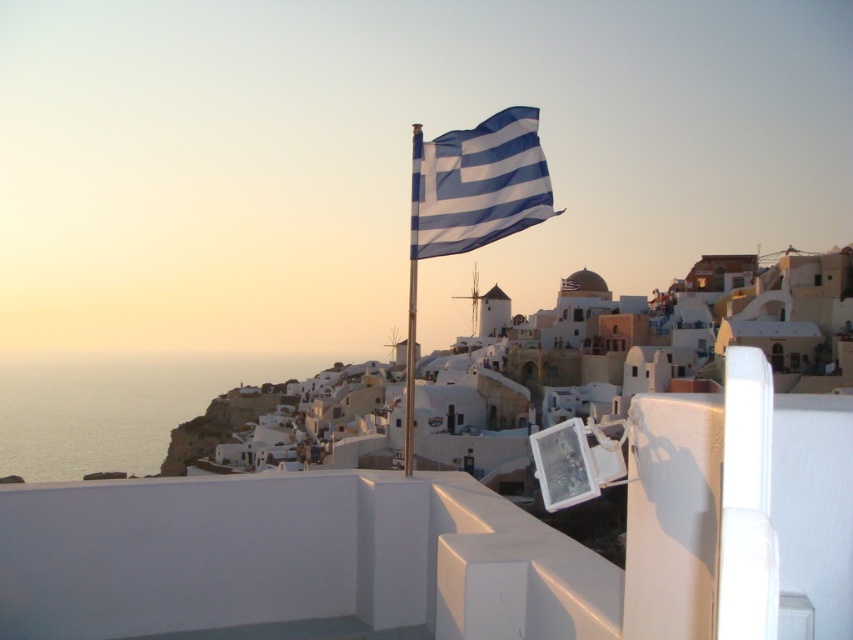
Question: Which of the following is the closest to the observer?

Choices:
 (A) (532, 154)
 (B) (436, 372)

Answer: (A)

Question: Which point is farther to the camera?

Choices:
 (A) coord(705,380)
 (B) coord(527,115)

Answer: (A)

Question: Does blue and white striped flag at center have a greater width compared to metallic silver flag pole at center?

Choices:
 (A) no
 (B) yes

Answer: (B)

Question: Does blue and white striped flag at center appear under metallic silver flag pole at center?

Choices:
 (A) yes
 (B) no

Answer: (B)

Question: Which point is closer to the camera?

Choices:
 (A) (543, 381)
 (B) (485, 173)
 (C) (415, 330)

Answer: (B)

Question: Considering the relative positions of blue and white striped flag at center and metallic silver flag pole at center in the image provided, where is blue and white striped flag at center located with respect to metallic silver flag pole at center?

Choices:
 (A) below
 (B) above

Answer: (B)